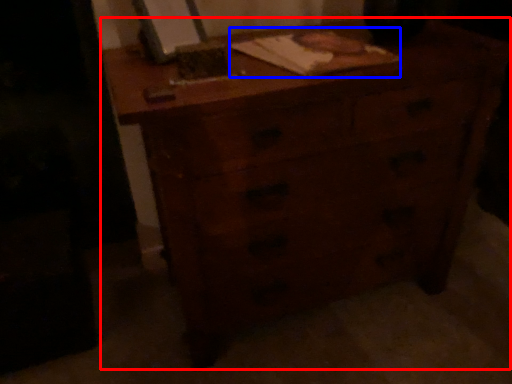
Question: Which object appears farthest to the camera in this image, chest of drawers (highlighted by a red box) or notebook (highlighted by a blue box)?

Choices:
 (A) chest of drawers
 (B) notebook

Answer: (B)